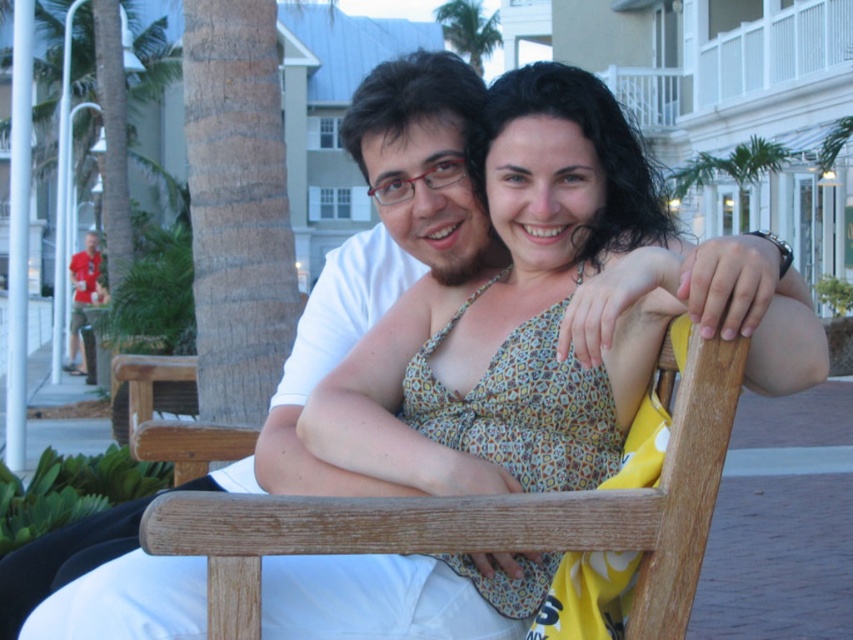
Question: Is wooden chair at center positioned at the back of green leafy palm tree at upper center?

Choices:
 (A) no
 (B) yes

Answer: (A)

Question: Is green leafy palm tree at upper right to the right of matte red shirt at left from the viewer's perspective?

Choices:
 (A) no
 (B) yes

Answer: (B)

Question: Which object is closer to the camera taking this photo?

Choices:
 (A) wooden chair at center
 (B) green leafy palm tree at upper center

Answer: (A)

Question: Based on their relative distances, which object is farther from the green leafy palm tree at upper center?

Choices:
 (A) green leafy palm tree at upper right
 (B) matte red shirt at left
 (C) wooden chair at center

Answer: (C)

Question: Is wooden chair at center thinner than matte red shirt at left?

Choices:
 (A) yes
 (B) no

Answer: (B)

Question: Considering the real-world distances, which object is closest to the matte red shirt at left?

Choices:
 (A) wooden chair at center
 (B) green leafy palm tree at upper center
 (C) green leafy palm tree at upper right

Answer: (C)